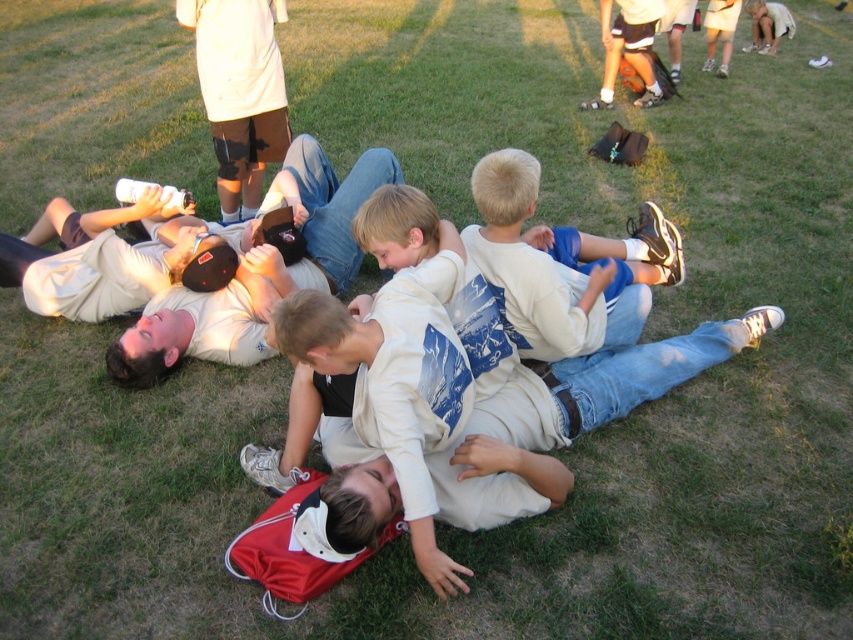
Looking at this image, you are a photographer trying to capture a candid shot of the children. You notice the white cotton shirt at center and the matte khaki cap at upper left. Which object is narrower in width?

The white cotton shirt at center is narrower in width than the matte khaki cap at upper left.

You are a photographer trying to capture a candid shot of the children. You notice the white matte shirt at center and the white matte knee pad at upper center. Which object is closer to the camera based on their heights in the image?

The white matte shirt at center has a lesser height compared to the white matte knee pad at upper center in the image, which suggests that the knee pad is closer to the camera since objects closer to the camera appear larger.

You are a photographer standing at the edge of the field. You want to take a photo that includes both the white cotton shirt at center and the light beige shirt at upper right. The camera you are using has a maximum focus range of 25 feet. Will you be able to capture both shirts in focus without moving closer?

The white cotton shirt at center is 26.19 feet away from the light beige shirt at upper right. Since the maximum focus range of the camera is 25 feet, the distance between them exceeds this limit. Therefore, you will not be able to capture both shirts in focus without moving closer.